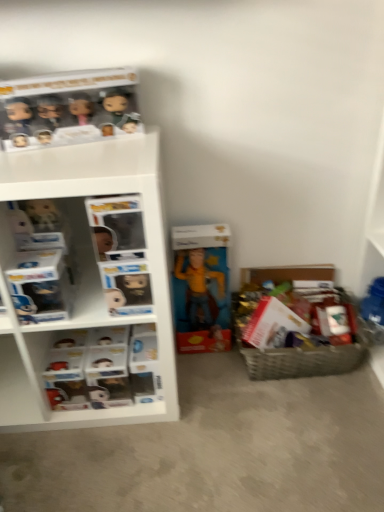
Question: Is point (165, 334) closer or farther from the camera than point (150, 390)?

Choices:
 (A) farther
 (B) closer

Answer: (B)

Question: Do you think white plastic shelf at left is within white plastic shelves at left, or outside of it?

Choices:
 (A) inside
 (B) outside

Answer: (B)

Question: Considering the real-world distances, which object is closest to the white plastic shelf at left?

Choices:
 (A) white plastic shelves at left
 (B) matte yellow action figure at center
 (C) woven brown basket at lower right
 (D) matte black figurines at upper left

Answer: (A)

Question: Based on their relative distances, which object is nearer to the white plastic shelves at left?

Choices:
 (A) matte yellow action figure at center
 (B) white plastic shelf at left
 (C) woven brown basket at lower right
 (D) matte black figurines at upper left

Answer: (B)